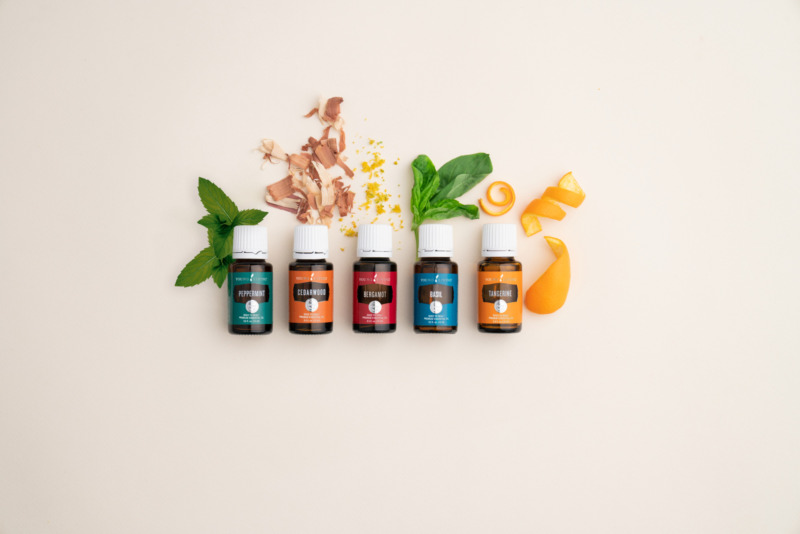
In order to click on five bottles in this screenshot , I will do `click(254, 293)`, `click(328, 299)`, `click(378, 306)`, `click(438, 316)`, `click(506, 308)`.